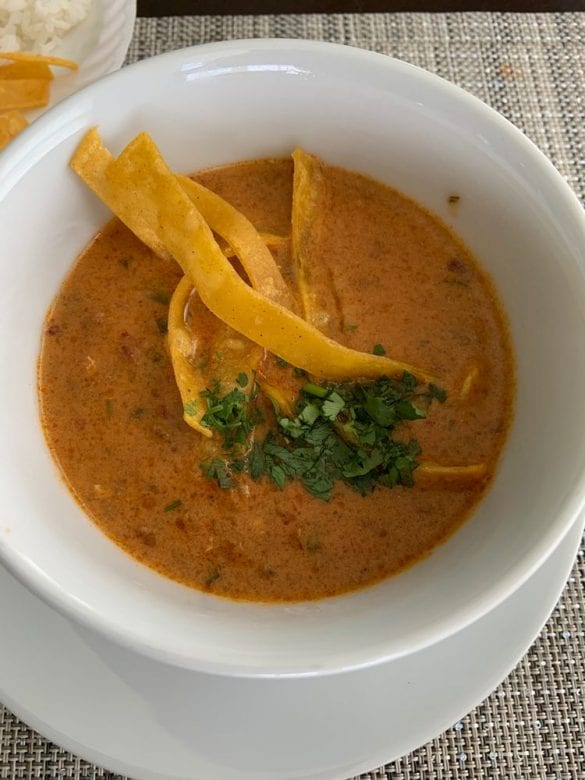
Locate an element on the screen. This screenshot has height=780, width=585. fabric is located at coordinates (515, 734).